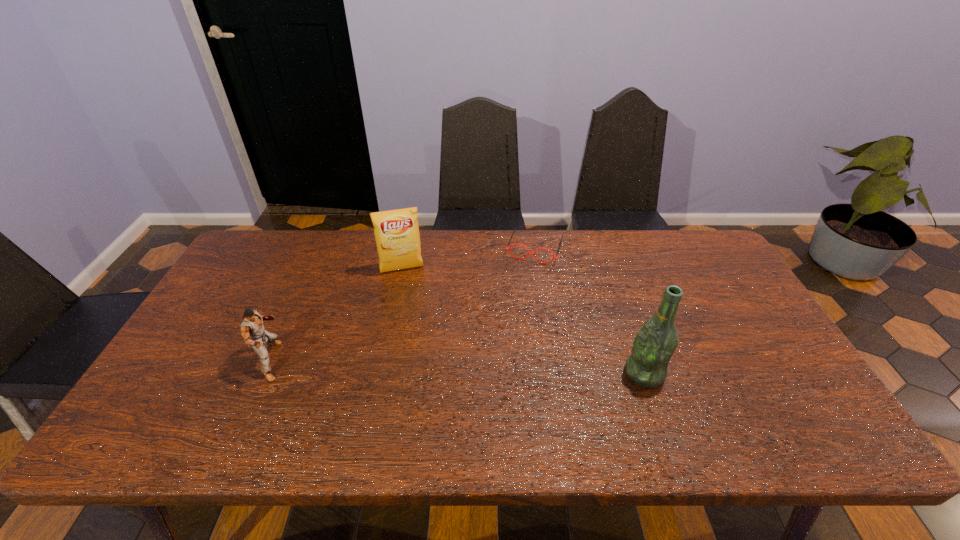
Locate an element on the screen. Image resolution: width=960 pixels, height=540 pixels. vacant space on the desktop that is between the puncher and the tallest object and is positioned on the front-facing side of the shortest object is located at coordinates (495, 368).

Image resolution: width=960 pixels, height=540 pixels. In order to click on vacant space on the desktop that is between the leftmost object and the beer bottle and is positioned on the front of the crisp (potato chip) with the logo in this screenshot , I will do `click(420, 366)`.